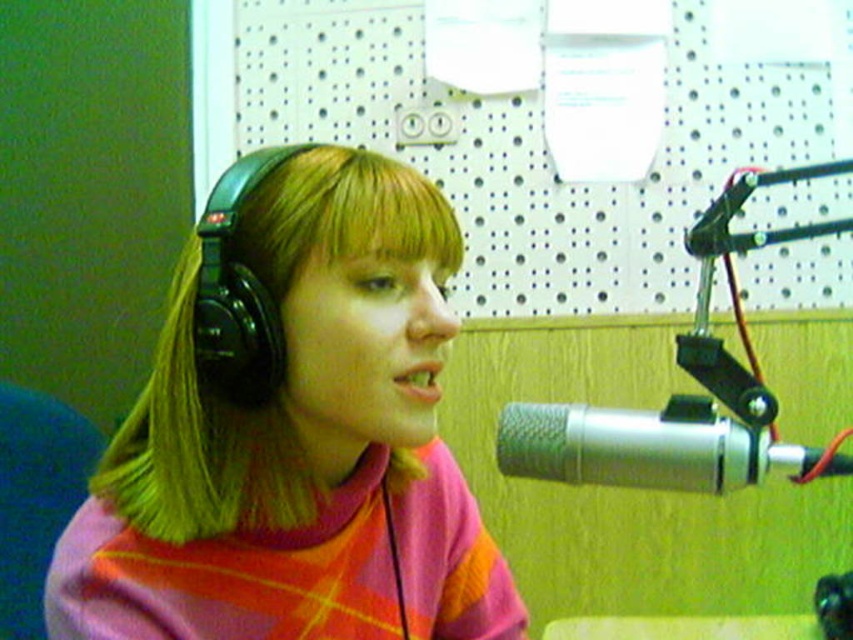
In the radio studio scene, there is a person wearing headphones and speaking into a microphone. The scene also includes a point labeled as point (297, 442). Based on the description, what object does this point correspond to?

The point corresponds to the matte black headphones at left.